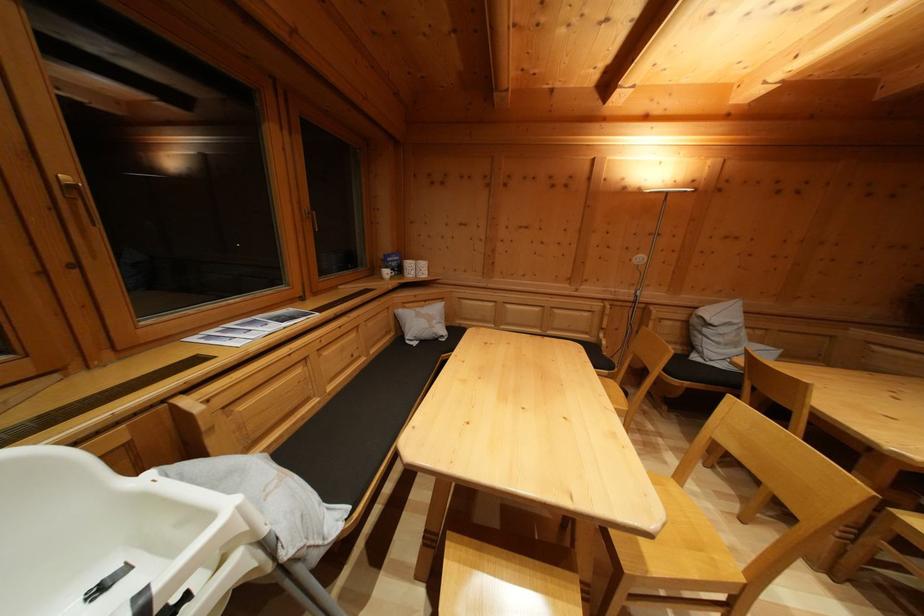
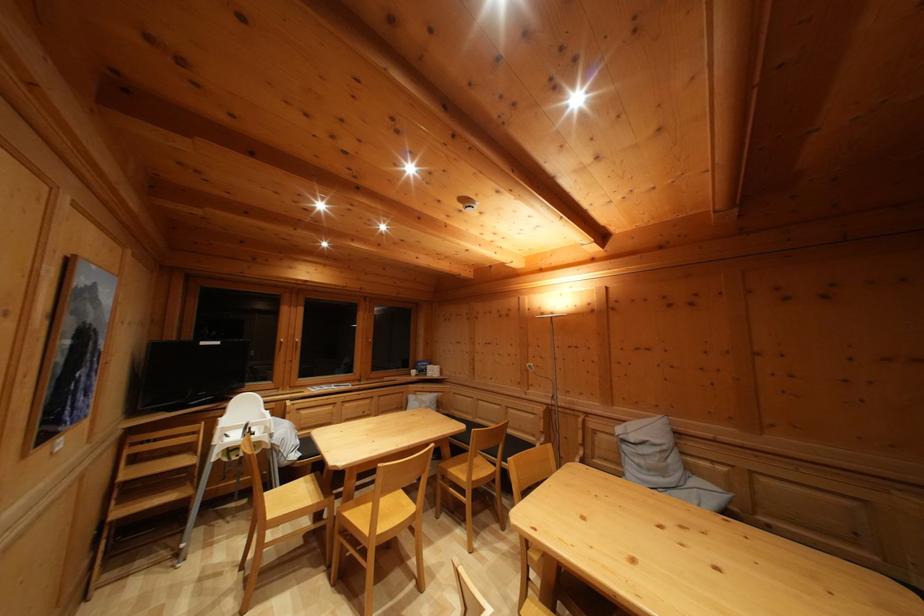
The point at (393, 280) is marked in the first image. Where is the corresponding point in the second image?

(419, 379)